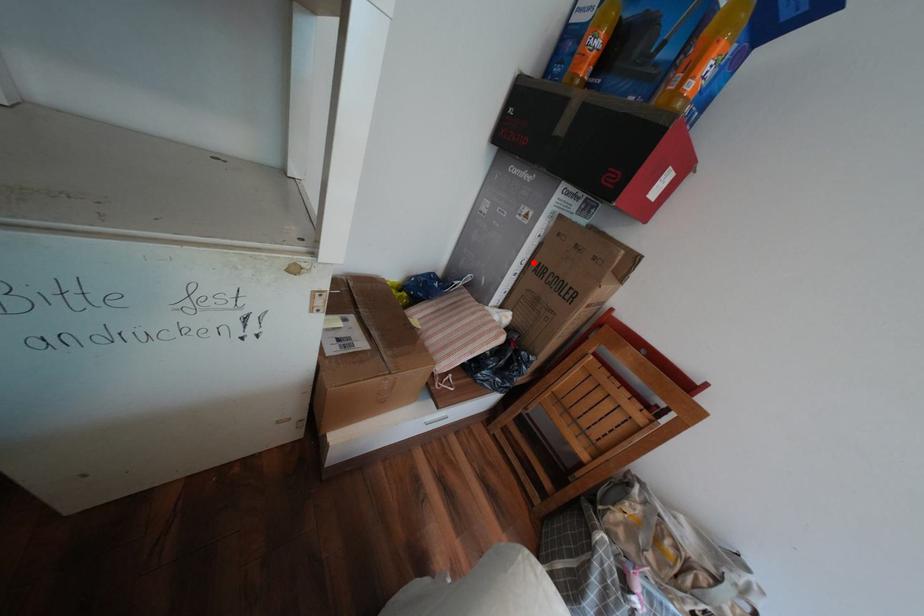
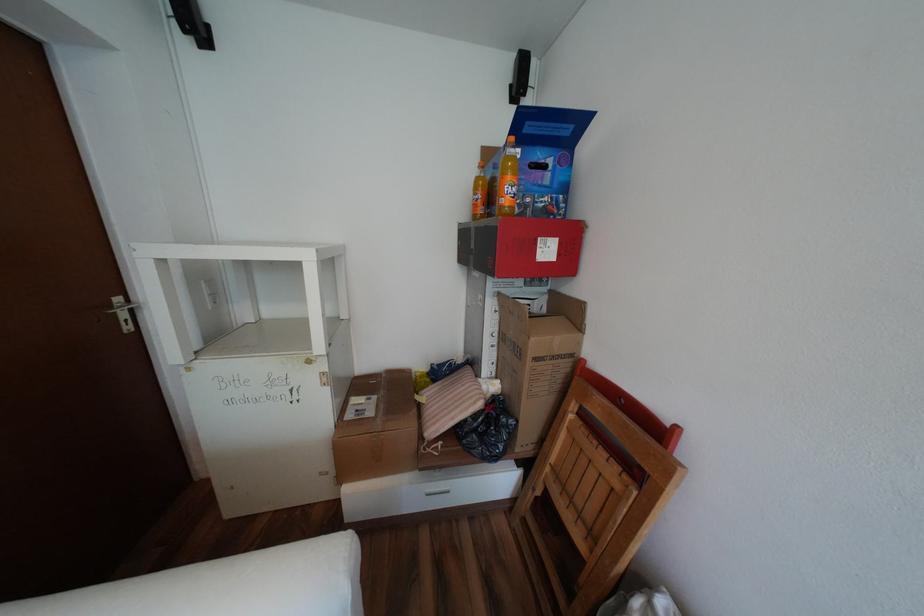
Question: I am providing you with two images of the same scene from different viewpoints. A red point is marked on the first image. Is the red point's position out of view in image 2?

Choices:
 (A) Yes
 (B) No

Answer: (B)